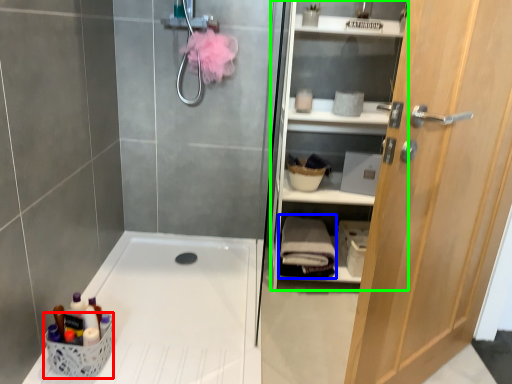
Question: Which object is positioned closest to basket (highlighted by a red box)? Select from bath towel (highlighted by a blue box) and shelf (highlighted by a green box).

Choices:
 (A) bath towel
 (B) shelf

Answer: (A)